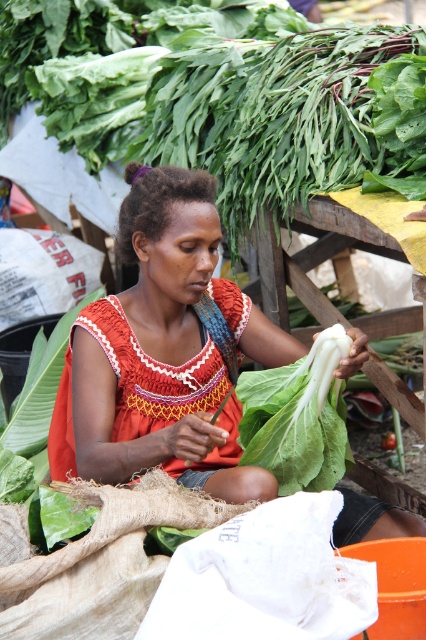
Which is behind, point (285, 353) or point (256, 397)?

The point (285, 353) is behind.

Does point (111, 332) come closer to viewer compared to point (252, 433)?

That is False.

Locate an element on the screen. matte orange blouse at center is located at coordinates (163, 353).

Is point (192, 96) less distant than point (241, 445)?

That is False.

Between green leafy vegetable at upper center and white leafy green at center, which one appears on the right side from the viewer's perspective?

From the viewer's perspective, white leafy green at center appears more on the right side.

The height and width of the screenshot is (640, 426). Describe the element at coordinates (249, 108) in the screenshot. I see `green leafy vegetable at upper center` at that location.

The width and height of the screenshot is (426, 640). Find the location of `green leafy vegetable at upper center`. green leafy vegetable at upper center is located at coordinates (249, 108).

Does green leafy vegetable at upper center appear over matte orange blouse at center?

Indeed, green leafy vegetable at upper center is positioned over matte orange blouse at center.

Is green leafy vegetable at upper center wider than matte orange blouse at center?

Yes.

Locate an element on the screen. The height and width of the screenshot is (640, 426). green leafy vegetable at upper center is located at coordinates (249, 108).